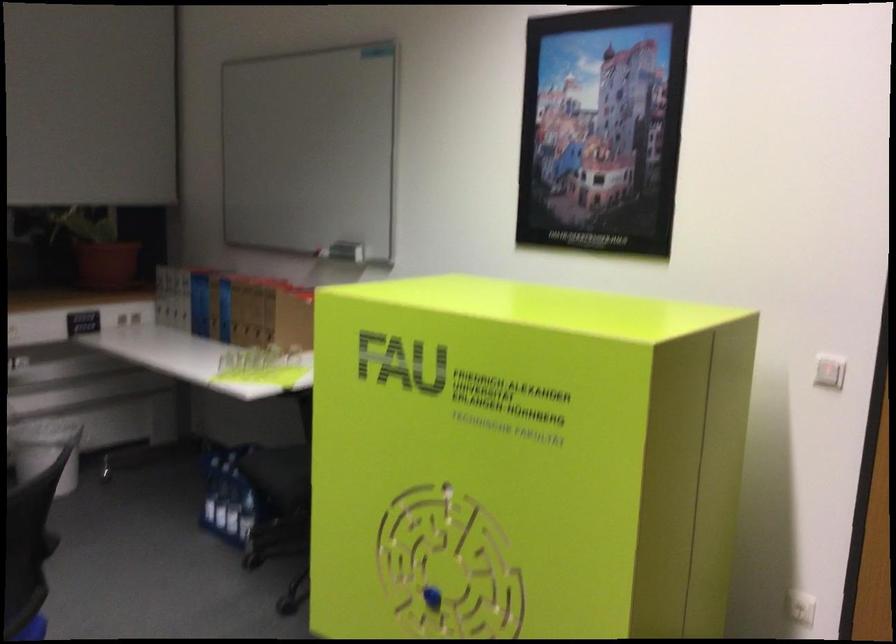
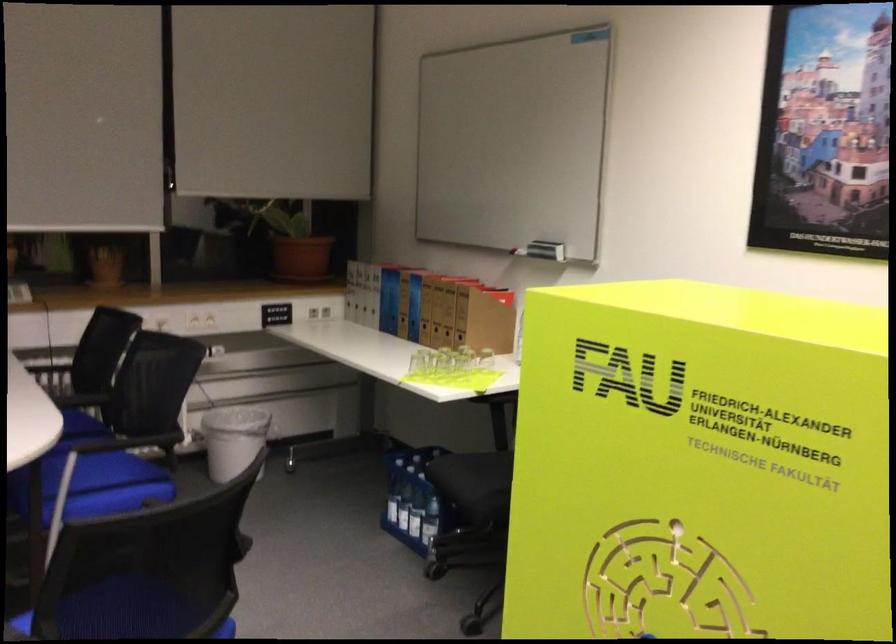
Question: The images are taken continuously from a first-person perspective. In which direction is your viewpoint rotating?

Choices:
 (A) Left
 (B) Right
 (C) Up
 (D) Down

Answer: (A)